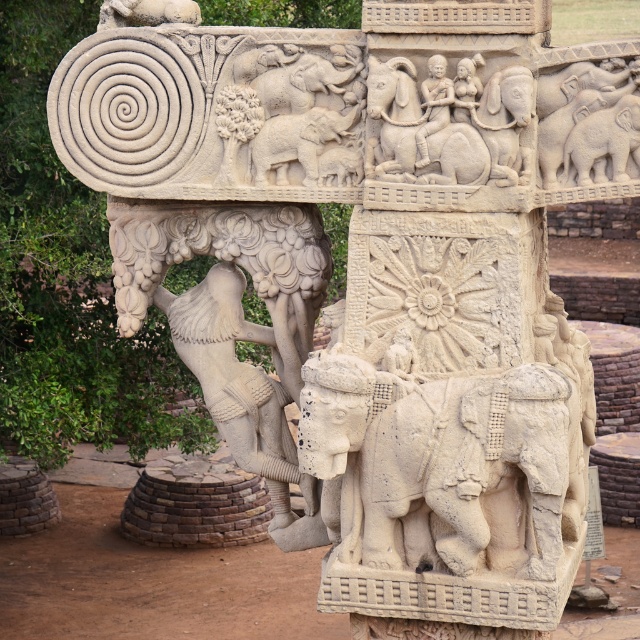
Question: In this image, where is white stone elephant at center located relative to smooth stone figure at center?

Choices:
 (A) right
 (B) left

Answer: (A)

Question: In this image, where is white stone elephant at center located relative to smooth stone figure at center?

Choices:
 (A) below
 (B) above

Answer: (A)

Question: Is white stone elephant at center wider than smooth stone figure at center?

Choices:
 (A) yes
 (B) no

Answer: (A)

Question: Which of the following is the closest to the observer?

Choices:
 (A) white stone elephant at center
 (B) smooth stone figure at center

Answer: (A)

Question: Which of the following is the farthest from the observer?

Choices:
 (A) smooth stone figure at center
 (B) white stone elephant at center

Answer: (A)